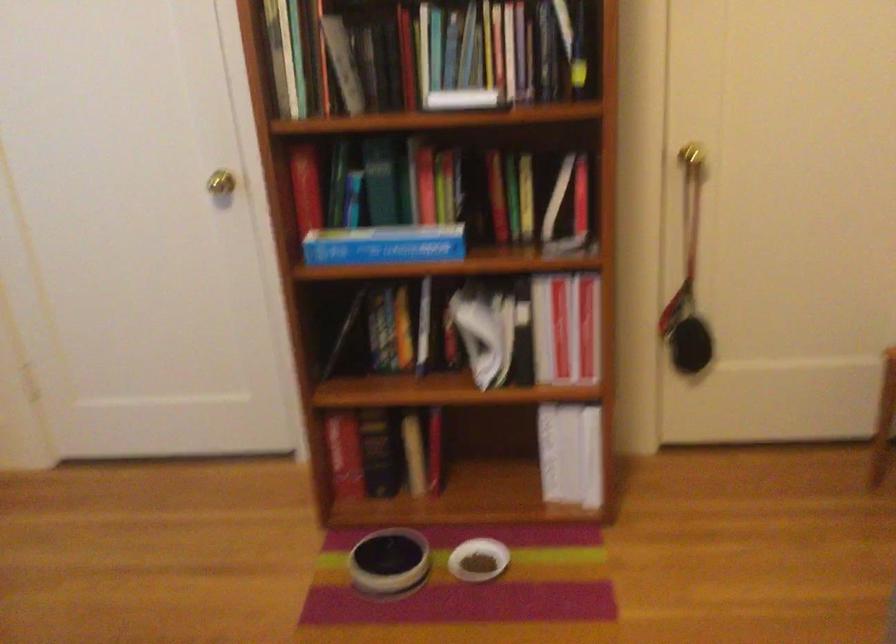
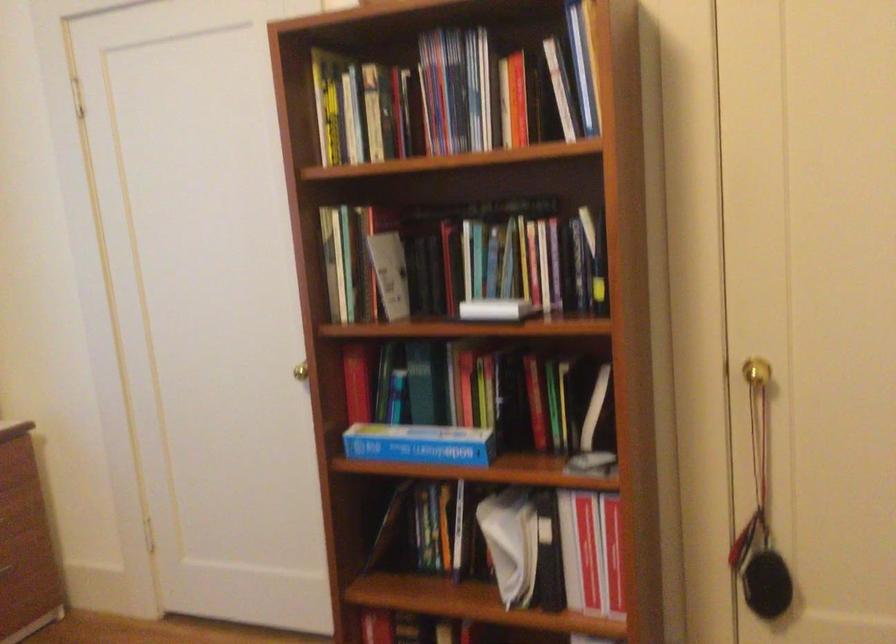
Locate, in the second image, the point that corresponds to point 700,153 in the first image.

(755, 372)